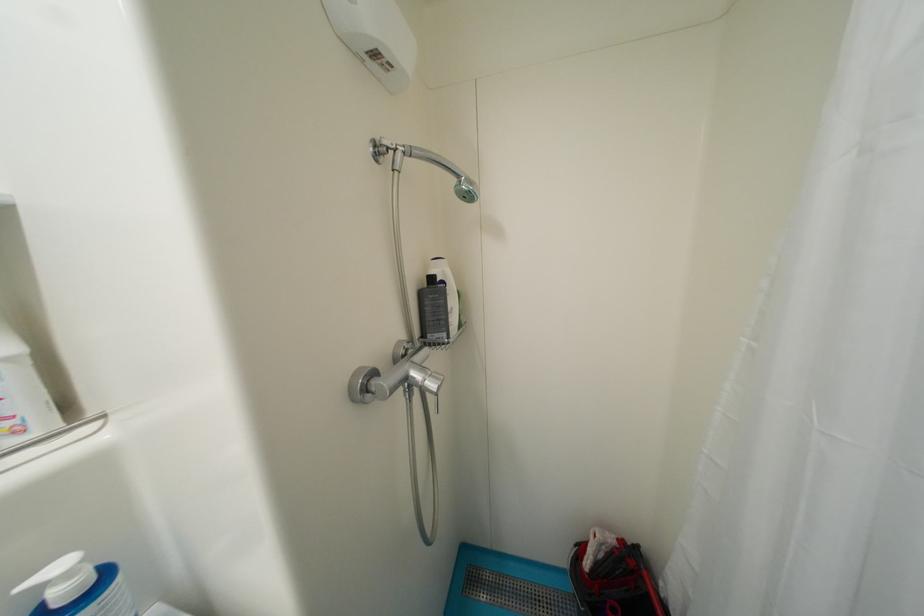
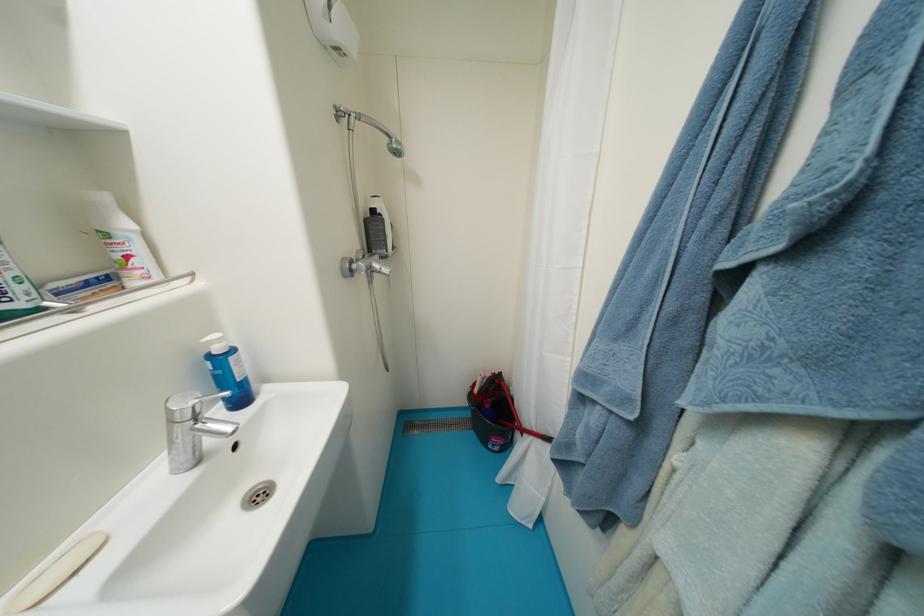
Where in the second image is the point corresponding to pixel 75 576 from the first image?

(225, 342)